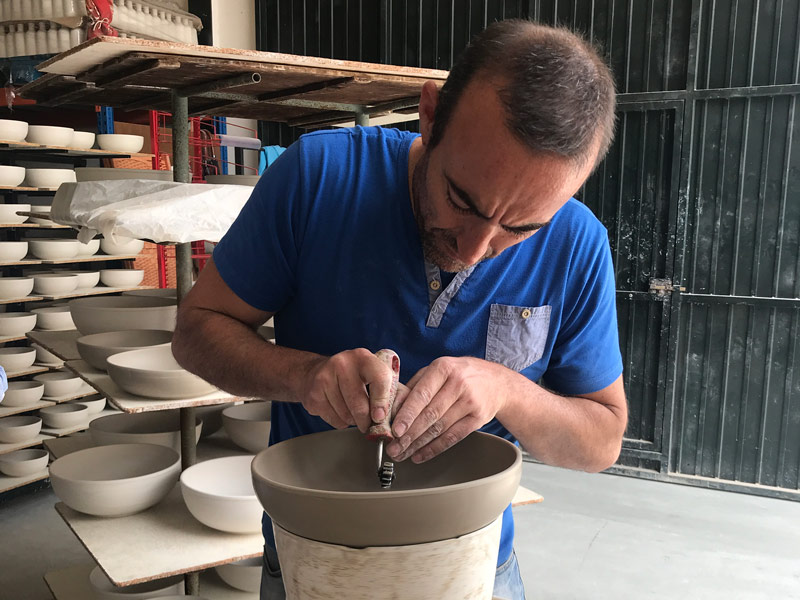
Find the location of a particular element. The width and height of the screenshot is (800, 600). table is located at coordinates (433, 581).